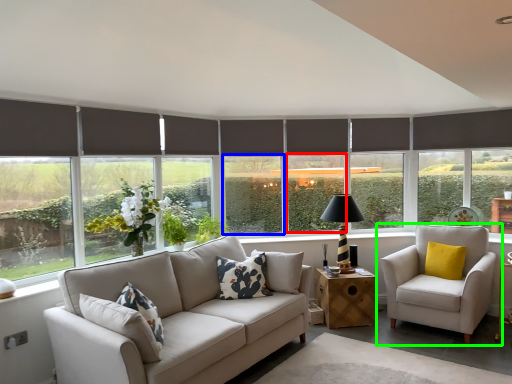
Question: Estimate the real-world distances between objects in this image. Which object is farther from window (highlighted by a red box), window screen (highlighted by a blue box) or chair (highlighted by a green box)?

Choices:
 (A) window screen
 (B) chair

Answer: (B)